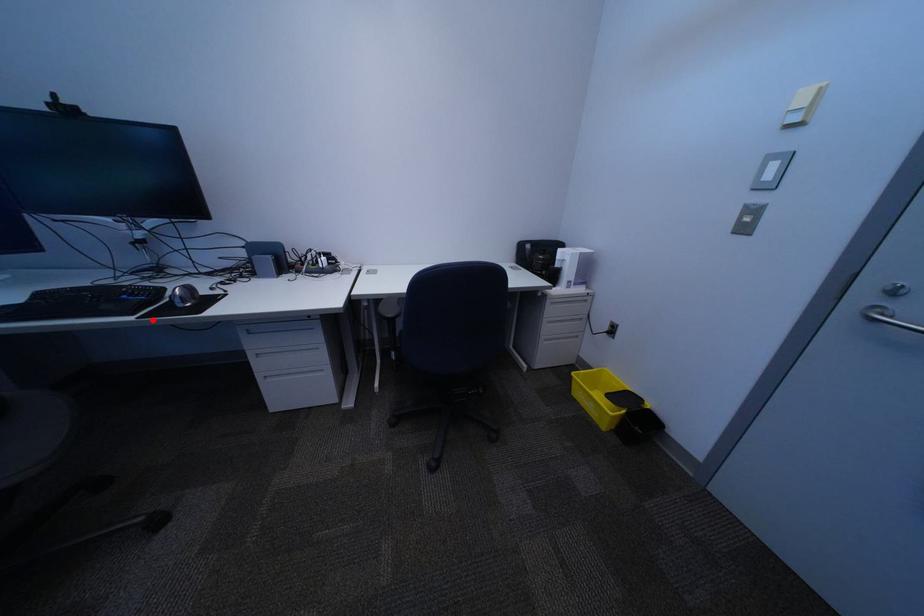
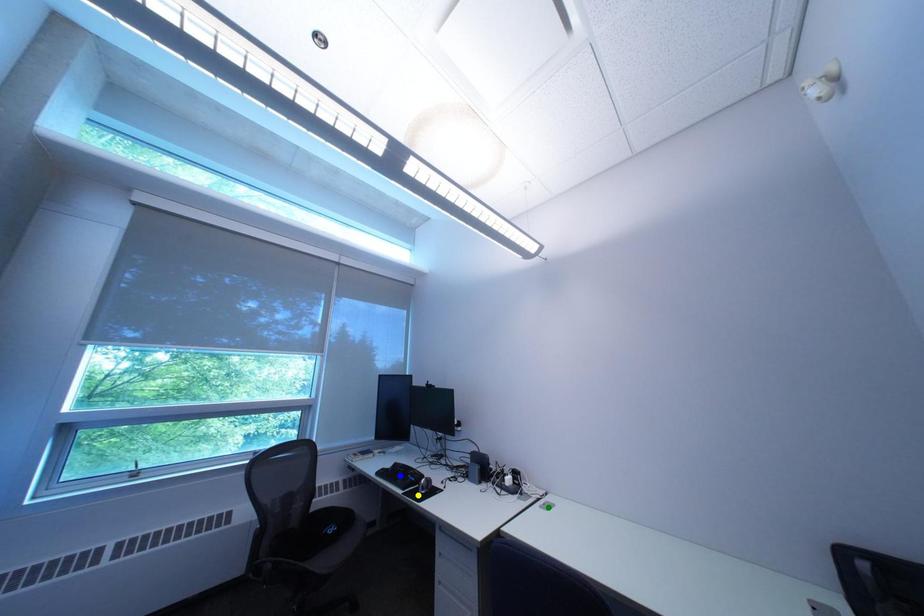
Question: I am providing you with two images of the same scene from different viewpoints. A red point is marked on the first image. You are given multiple points on the second image. Which point in image 2 represents the same 3d spot as the red point in image 1?

Choices:
 (A) green point
 (B) yellow point
 (C) blue point

Answer: (B)